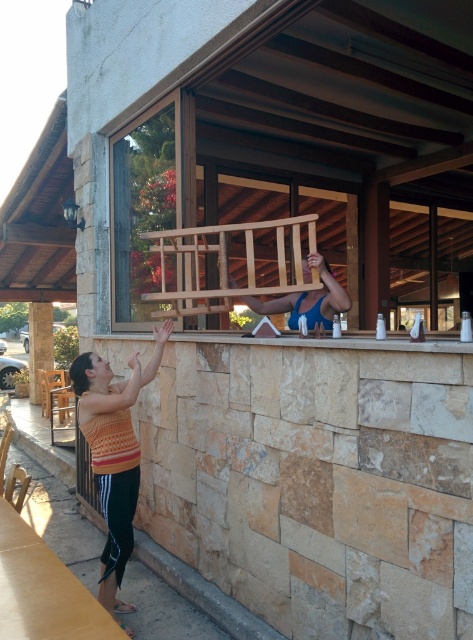
Does orange striped tank top at lower left appear on the right side of brown stone pillar at lower left?

Indeed, orange striped tank top at lower left is positioned on the right side of brown stone pillar at lower left.

Does orange striped tank top at lower left appear over brown stone pillar at lower left?

Incorrect, orange striped tank top at lower left is not positioned above brown stone pillar at lower left.

At what (x,y) coordinates should I click in order to perform the action: click on orange striped tank top at lower left. Please return your answer as a coordinate pair (x, y). The height and width of the screenshot is (640, 473). Looking at the image, I should click on (113, 452).

Is blue fabric at center below brown stone pillar at lower left?

Actually, blue fabric at center is above brown stone pillar at lower left.

The height and width of the screenshot is (640, 473). I want to click on blue fabric at center, so click(x=307, y=298).

Does point (331, 285) lie in front of point (47, 324)?

Yes, point (331, 285) is closer to viewer.

The height and width of the screenshot is (640, 473). Find the location of `blue fabric at center`. blue fabric at center is located at coordinates (307, 298).

Between wooden rail at center and brown stone pillar at lower left, which one appears on the left side from the viewer's perspective?

Positioned to the left is brown stone pillar at lower left.

Measure the distance between wooden rail at center and camera.

wooden rail at center is 9.76 feet from camera.

You are a GUI agent. You are given a task and a screenshot of the screen. Output one action in this format:
    pyautogui.click(x=<x>, y=<y>)
    Task: Click on the wooden rail at center
    The height and width of the screenshot is (640, 473).
    Given the screenshot: What is the action you would take?
    pyautogui.click(x=227, y=262)